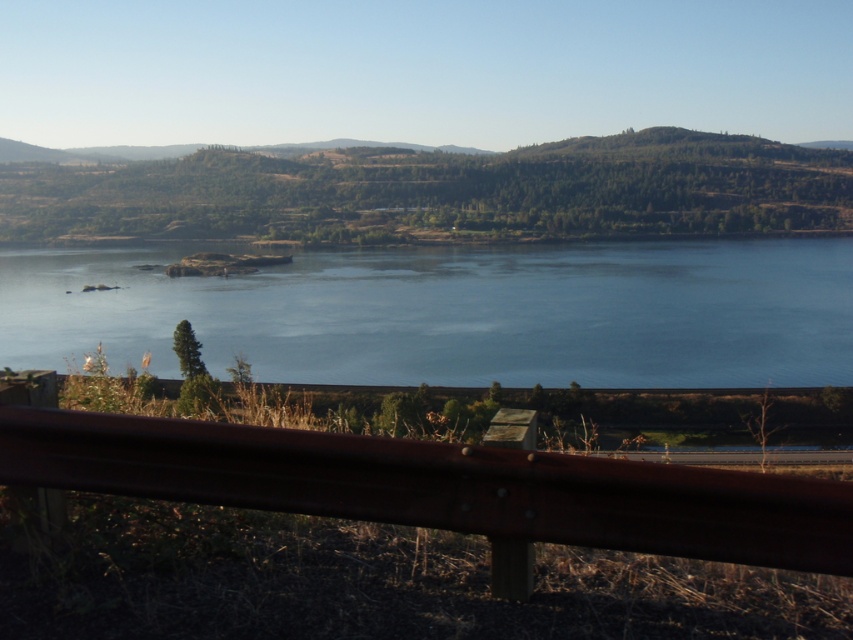
You are standing on the road and see the blue water at center and the brown metallic rail at lower center. Which object is closer to you?

The brown metallic rail at lower center is closer to you because it is positioned in front of the blue water at center, which is further away.

You are standing at the guardrail and want to look at two points in the scene. The first point is at coordinates point (791, 268) and the second is at point (302, 488). Which point do you see closer to you?

Point (302, 488) is closer to you because point (791, 268) is behind it.

You are a photographer planning to capture the blue water at center and the brown metallic rail at lower center in a single frame. Based on their sizes in the image, which object will appear smaller in the photo?

The blue water at center will appear smaller in the photo because its width is less than that of the brown metallic rail at lower center.